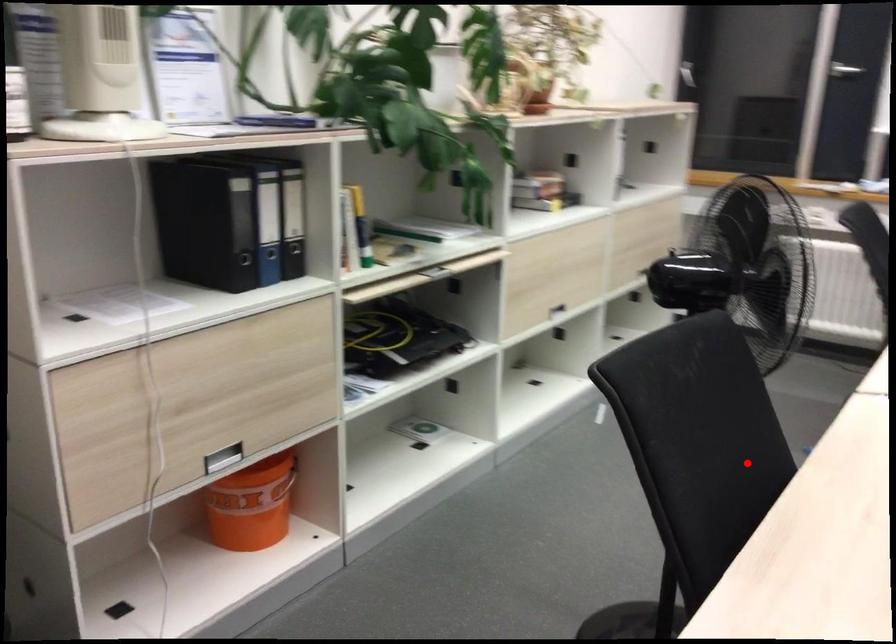
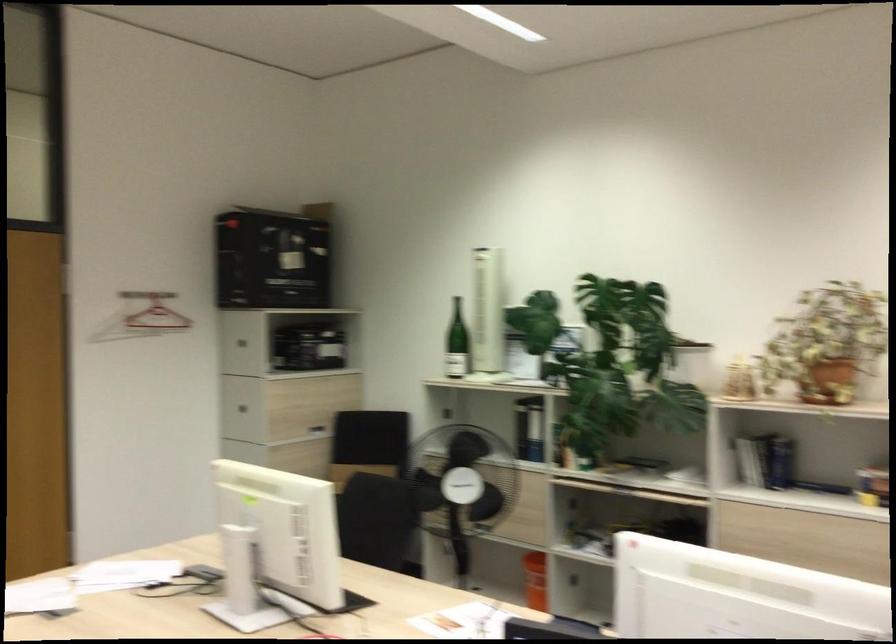
Question: A red point is marked in image1. In image2, is the corresponding 3D point closer to the camera or farther? Reply with the corresponding letter.

Choices:
 (A) The corresponding 3D point is closer.
 (B) The corresponding 3D point is farther.

Answer: (B)